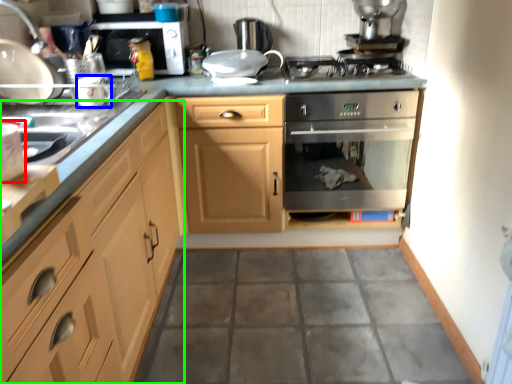
Question: Which is nearer to the appliance (highlighted by a red box)? appliance (highlighted by a blue box) or cabinetry (highlighted by a green box).

Choices:
 (A) appliance
 (B) cabinetry

Answer: (B)